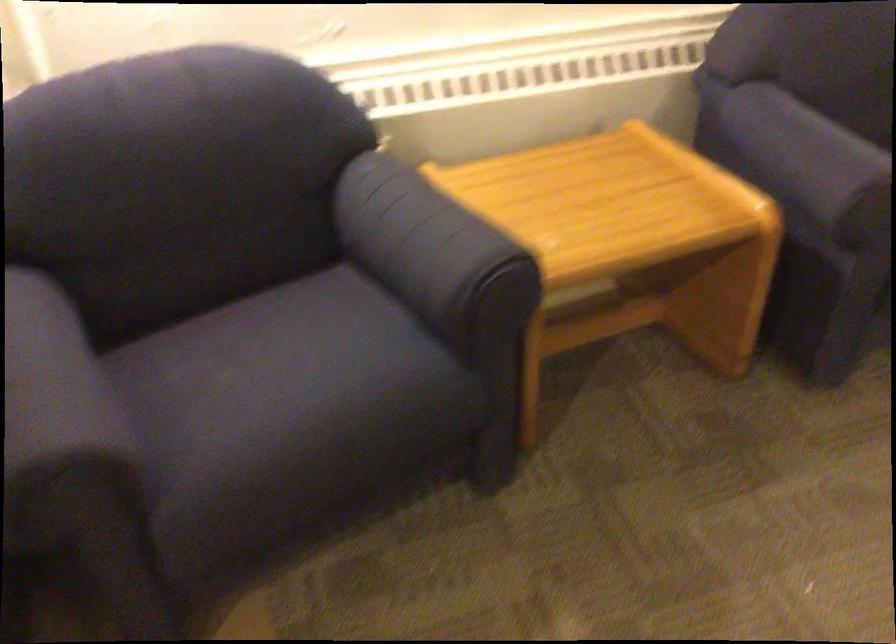
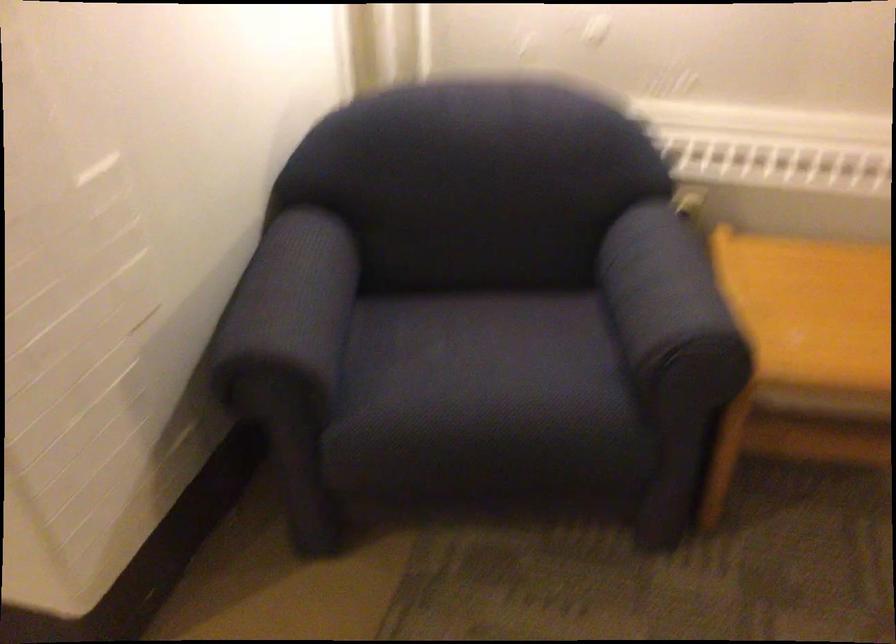
Where in the second image is the point corresponding to point 460,249 from the first image?

(670, 307)